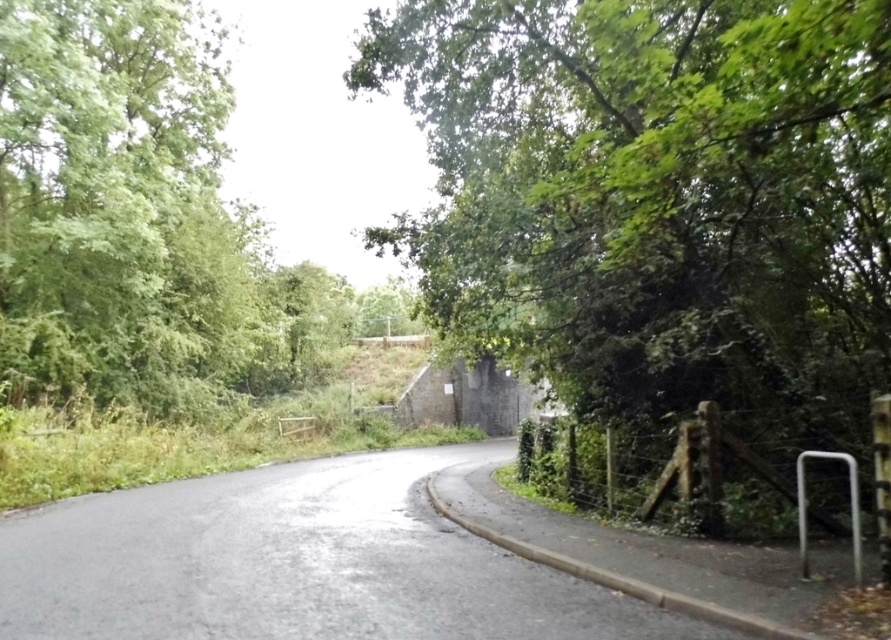
Who is more distant from viewer, [813,304] or [86,97]?

Point [86,97]

Between green leafy tree at center and green leafy tree at left, which one has less height?

Standing shorter between the two is green leafy tree at center.

Is point (765, 120) positioned before point (178, 113)?

Yes, point (765, 120) is in front of point (178, 113).

Locate an element on the screen. The image size is (891, 640). green leafy tree at center is located at coordinates (657, 198).